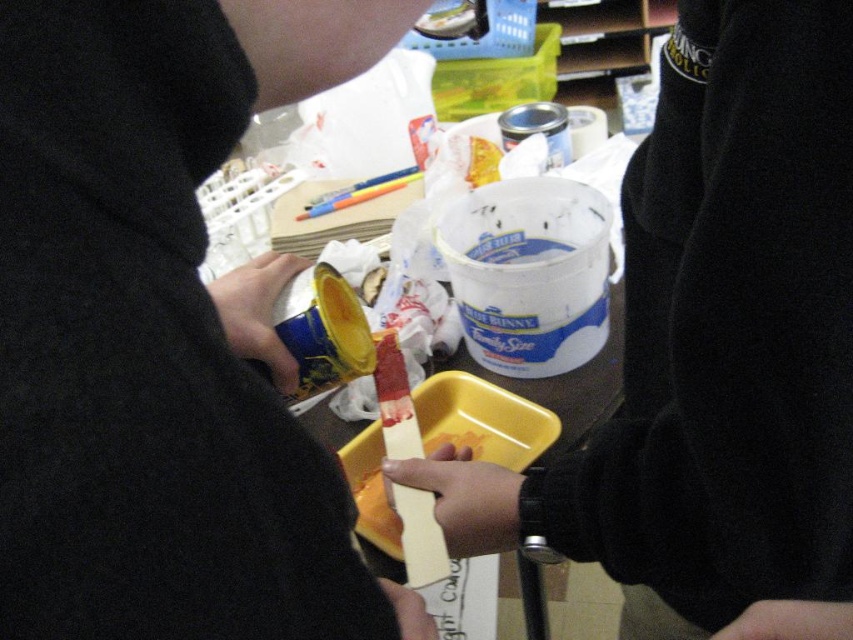
Consider the image. Is metallic blue can at center positioned behind yellow plastic tray at center?

That is False.

Find the location of `metallic blue can at center`. metallic blue can at center is located at coordinates click(x=161, y=332).

The image size is (853, 640). Identify the location of metallic blue can at center. coord(161,332).